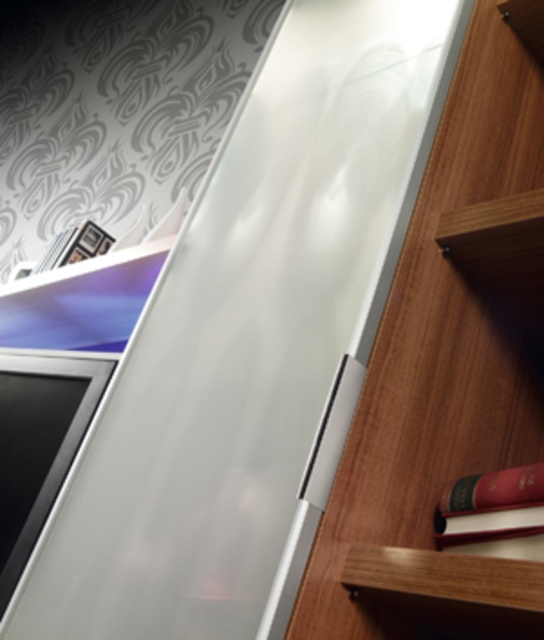
You are organizing books on a shelf and need to place the red leather book at lower right next to the wooden bookcase at right. Is there enough space between them to fit a 12 inch thick dictionary?

The red leather book at lower right is 11.83 inches away from the wooden bookcase at right. Since the dictionary is 12 inches thick, there isn not enough space to fit it between them.

You are an interior designer assessing the layout of this room. You need to determine if the wooden bookcase at right can be moved closer to the entrance without disturbing the red leather book at lower right. Based on their positions, is this feasible?

The wooden bookcase at right is behind the red leather book at lower right, so moving the wooden bookcase at right closer to the entrance would not interfere with the red leather book at lower right as it is positioned behind it.

You are standing in the room and want to place a new book on the shelf above the TV. The book is exactly at point (491, 506). Is this point on the shelf above the TV?

The point (491, 506) corresponds to the red leather book at lower right, which is not on the shelf above the TV. Therefore, placing the book there would not be on the desired shelf.